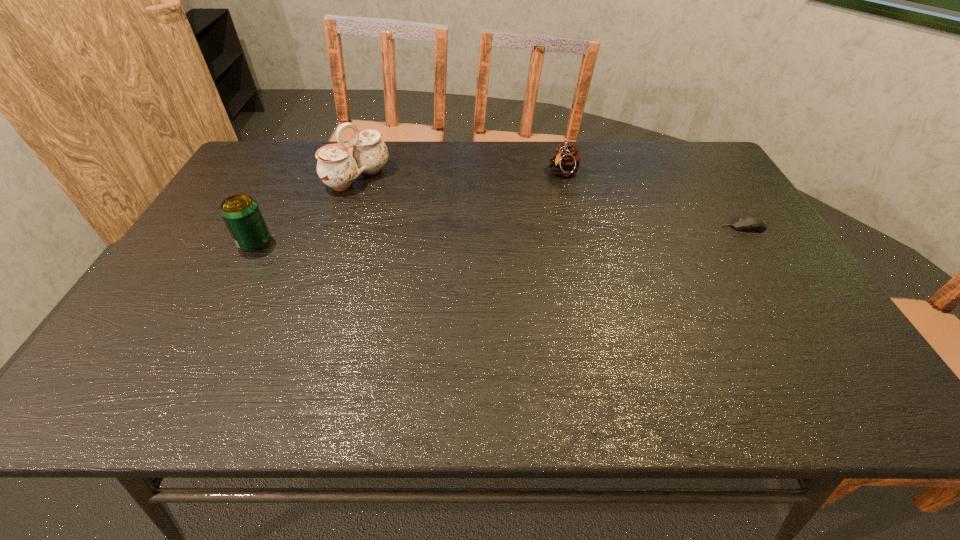
I want to click on beer can, so click(240, 212).

Find the location of a particular element. the leftmost object is located at coordinates (240, 212).

Locate an element on the screen. the shortest object is located at coordinates (753, 223).

Identify the location of the rightmost object. (753, 223).

You are a GUI agent. You are given a task and a screenshot of the screen. Output one action in this format:
    pyautogui.click(x=<x>, y=<y>)
    Task: Click on the pinecone
    This screenshot has width=960, height=540.
    Given the screenshot: What is the action you would take?
    pyautogui.click(x=565, y=160)

Locate an element on the screen. The image size is (960, 540). the second shortest object is located at coordinates (565, 160).

In order to click on the tallest object in this screenshot , I will do `click(339, 164)`.

Where is `chinaware`? The width and height of the screenshot is (960, 540). chinaware is located at coordinates (339, 164).

The image size is (960, 540). Identify the location of vacant space located 0.350m on the back of the third shortest object. (298, 163).

Identify the location of vacant space located 0.220m on the front of the shortest object. (786, 293).